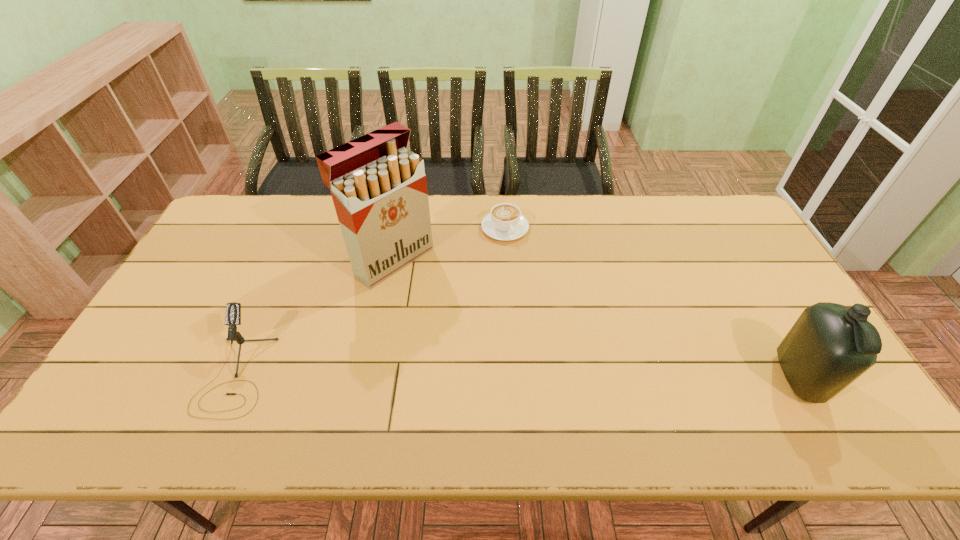
At what (x,y) coordinates should I click in order to perform the action: click on vacant space located 0.250m on the side of the cappuccino with the handle. Please return your answer as a coordinate pair (x, y). This screenshot has height=540, width=960. Looking at the image, I should click on (540, 299).

This screenshot has height=540, width=960. I want to click on vacant space located 0.250m on the side of the cappuccino with the handle, so click(x=540, y=299).

In order to click on free space located with the lid open on the cigarette case in this screenshot , I will do click(x=500, y=343).

At what (x,y) coordinates should I click in order to perform the action: click on free spot located 0.340m with the lid open on the cigarette case. Please return your answer as a coordinate pair (x, y). Looking at the image, I should click on (503, 346).

Where is `free space located 0.340m with the lid open on the cigarette case`? free space located 0.340m with the lid open on the cigarette case is located at coordinates (503, 346).

You are a GUI agent. You are given a task and a screenshot of the screen. Output one action in this format:
    pyautogui.click(x=<x>, y=<y>)
    Task: Click on the cappuccino that is positioned at the far edge
    Image resolution: width=960 pixels, height=540 pixels.
    Given the screenshot: What is the action you would take?
    pyautogui.click(x=505, y=222)

Locate an element on the screen. cigarette case situated at the far edge is located at coordinates (379, 189).

The image size is (960, 540). In order to click on microphone positioned at the near edge in this screenshot , I will do `click(233, 310)`.

The width and height of the screenshot is (960, 540). Find the location of `bottle present at the near edge`. bottle present at the near edge is located at coordinates (830, 345).

The height and width of the screenshot is (540, 960). What are the coordinates of `object that is at the right edge` in the screenshot? It's located at (830, 345).